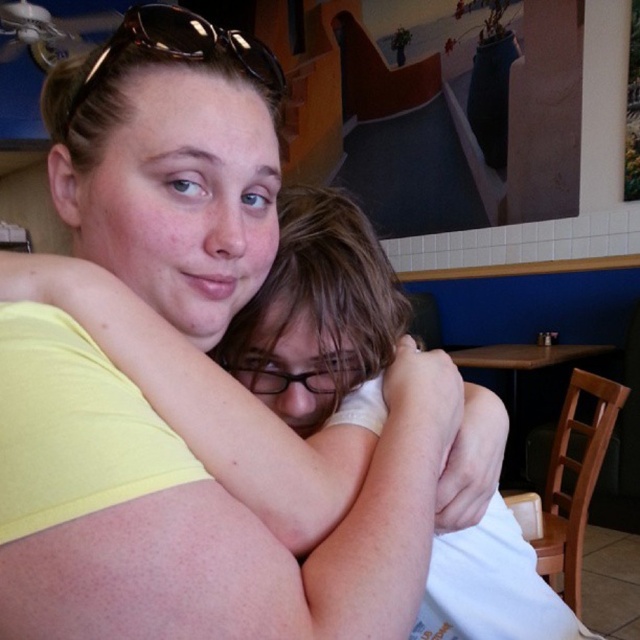
Which is more to the left, yellow matte shirt at center or brown plastic sunglasses at upper center?

brown plastic sunglasses at upper center is more to the left.

Identify the location of yellow matte shirt at center. (209, 508).

Is point (390, 474) farther from camera compared to point (109, 38)?

No, it is not.

The width and height of the screenshot is (640, 640). I want to click on yellow matte shirt at center, so click(x=209, y=508).